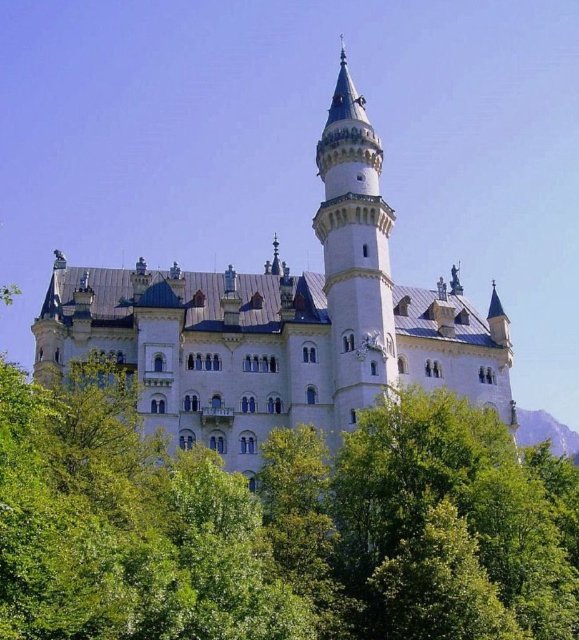
Question: Is white stone castle at center further to camera compared to white stone tower at center?

Choices:
 (A) no
 (B) yes

Answer: (A)

Question: Does white stone tower at center have a greater width compared to green grassy hill at lower right?

Choices:
 (A) no
 (B) yes

Answer: (A)

Question: Which point is closer to the camera?

Choices:
 (A) (567, 436)
 (B) (368, 128)
 (C) (438, 387)

Answer: (C)

Question: Among these points, which one is farthest from the camera?

Choices:
 (A) (298, 353)
 (B) (540, 428)

Answer: (B)

Question: Does white stone castle at center appear over green grassy hill at lower right?

Choices:
 (A) yes
 (B) no

Answer: (A)

Question: Which point is closer to the camera taking this photo?

Choices:
 (A) (360, 104)
 (B) (541, 420)

Answer: (A)